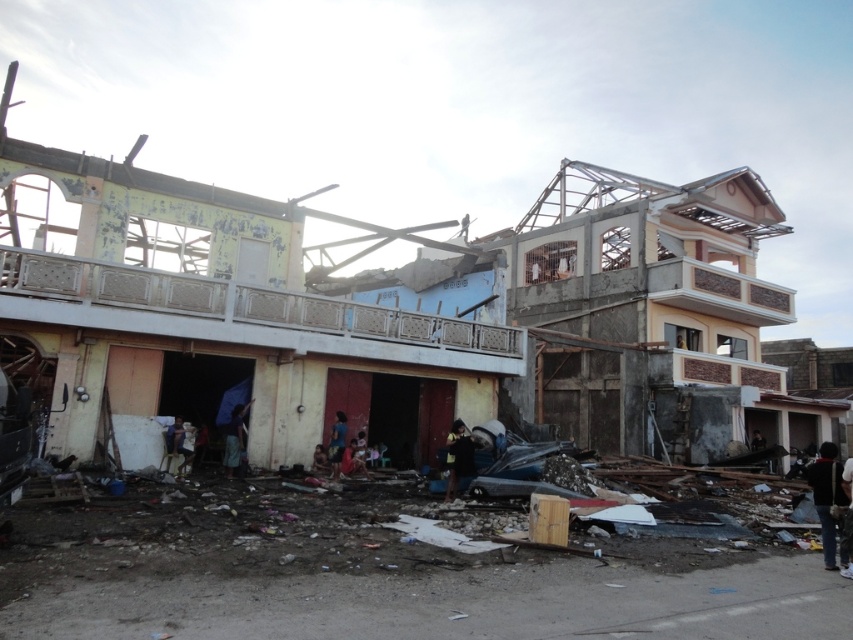
Question: Can you confirm if blue fabric at center is thinner than red fabric cloth at center?

Choices:
 (A) no
 (B) yes

Answer: (B)

Question: Among these points, which one is nearest to the camera?

Choices:
 (A) (759, 445)
 (B) (451, 483)

Answer: (B)

Question: Which point is farther to the camera?

Choices:
 (A) black fabric at center
 (B) blue fabric at lower center
 (C) dark blue fabric at lower left
 (D) black fabric bag at lower right

Answer: (B)

Question: Estimate the real-world distances between objects in this image. Which object is farther from the dark fabric person at lower right?

Choices:
 (A) dark skin human at lower center
 (B) red fabric cloth at center

Answer: (A)

Question: Can you confirm if blue fabric at center is positioned to the right of dark blue fabric at lower left?

Choices:
 (A) no
 (B) yes

Answer: (B)

Question: Does dark skin human at lower center appear on the left side of dark fabric person at lower right?

Choices:
 (A) yes
 (B) no

Answer: (A)